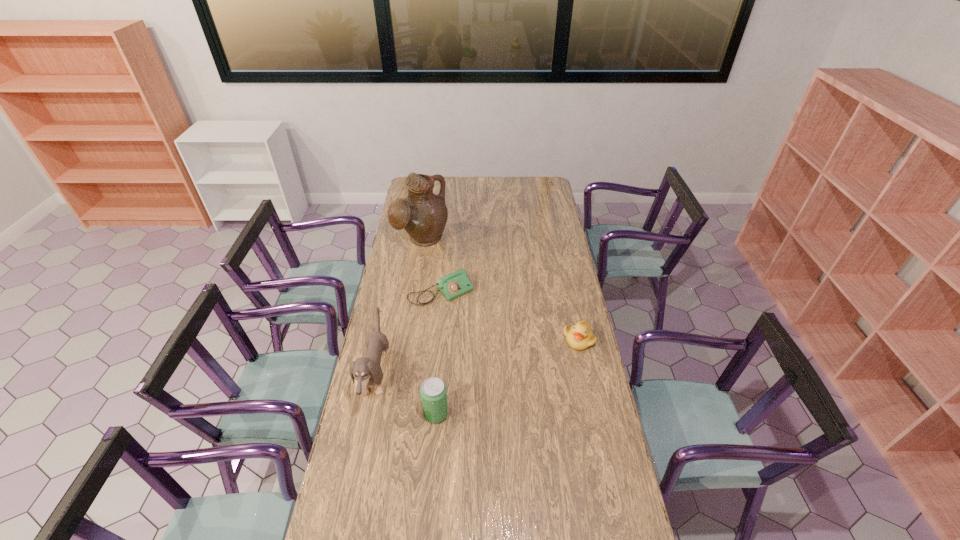
Find the location of a particular element. This screenshot has width=960, height=540. free spot located on the dial of the second farthest object is located at coordinates (492, 346).

Find the location of a particular element. free spot located 0.080m on the dial of the second farthest object is located at coordinates (468, 317).

You are a GUI agent. You are given a task and a screenshot of the screen. Output one action in this format:
    pyautogui.click(x=<x>, y=<y>)
    Task: Click on the vacant space located 0.330m on the dial of the second farthest object
    This screenshot has height=540, width=960.
    Given the screenshot: What is the action you would take?
    pyautogui.click(x=500, y=354)

Find the location of a particular element. vacant space located 0.110m at the spout of the tallest object is located at coordinates (444, 267).

Find the location of a particular element. vacant area situated at the spout of the tallest object is located at coordinates click(446, 269).

Locate an element on the screen. The image size is (960, 540). vacant space located at the spout of the tallest object is located at coordinates (461, 285).

The height and width of the screenshot is (540, 960). I want to click on vacant space located at the face of the puppy, so click(475, 377).

The height and width of the screenshot is (540, 960). Find the location of `free location located 0.290m at the face of the puppy`. free location located 0.290m at the face of the puppy is located at coordinates tap(463, 377).

This screenshot has width=960, height=540. Identify the location of vacant space situated 0.280m at the face of the puppy. (460, 377).

Identify the location of telephone at the left edge. This screenshot has height=540, width=960. (455, 284).